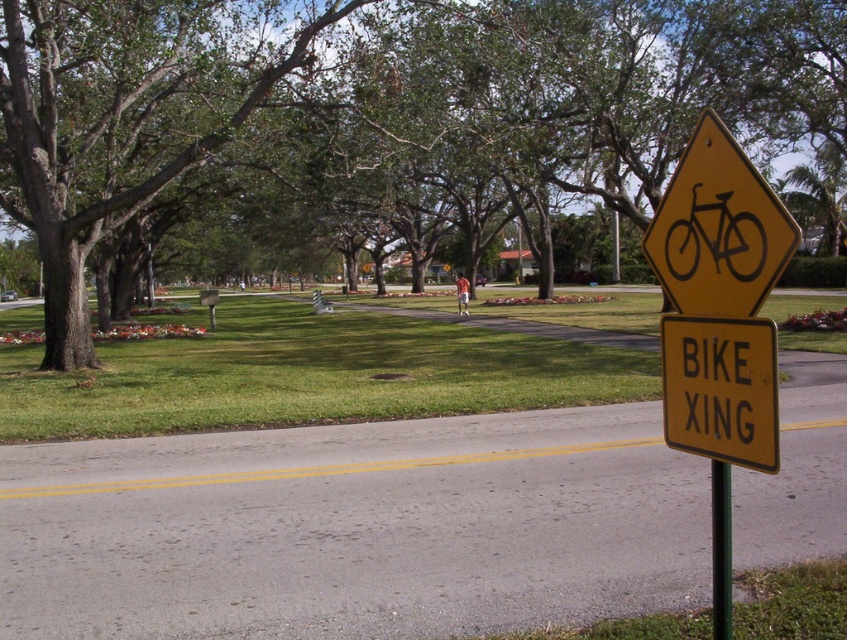
You are standing at the yellow diamond sign with a black bicycle silhouette. Which direction should you walk to reach the green leafy tree at center?

The green leafy tree at center is located at point coordinates that are to the north of your current position at the yellow diamond sign. Therefore, you should walk north to reach it.